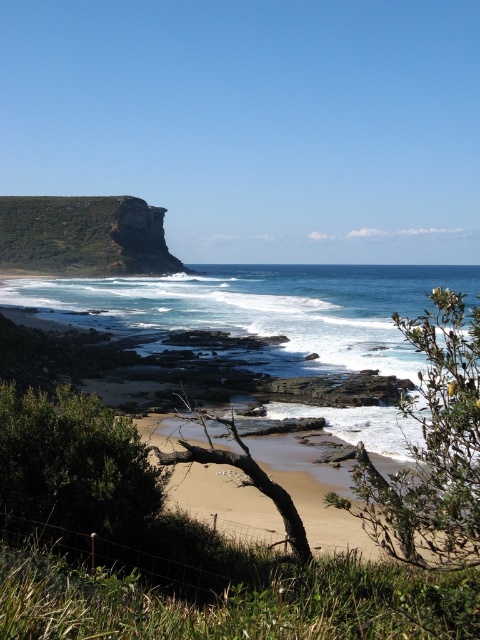
Is point (210, 452) positioned in front of point (101, 243)?

That is True.

Is light brown sandy beach at center to the left of green grassy cliff at upper left from the viewer's perspective?

In fact, light brown sandy beach at center is to the right of green grassy cliff at upper left.

Which is behind, point (383, 518) or point (44, 250)?

The point (44, 250) is more distant.

Identify the location of light brown sandy beach at center. (254, 496).